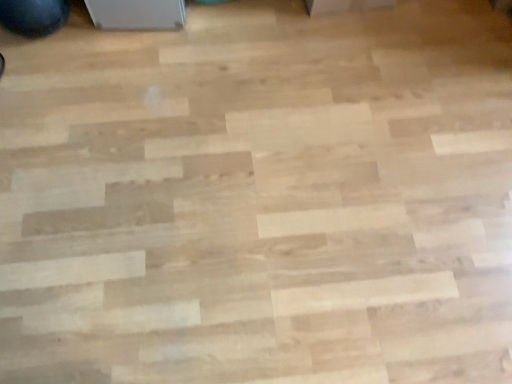
Locate an element on the screen. Image resolution: width=512 pixels, height=384 pixels. free area below matte black shoe at upper left (from a real-world perspective) is located at coordinates (54, 33).